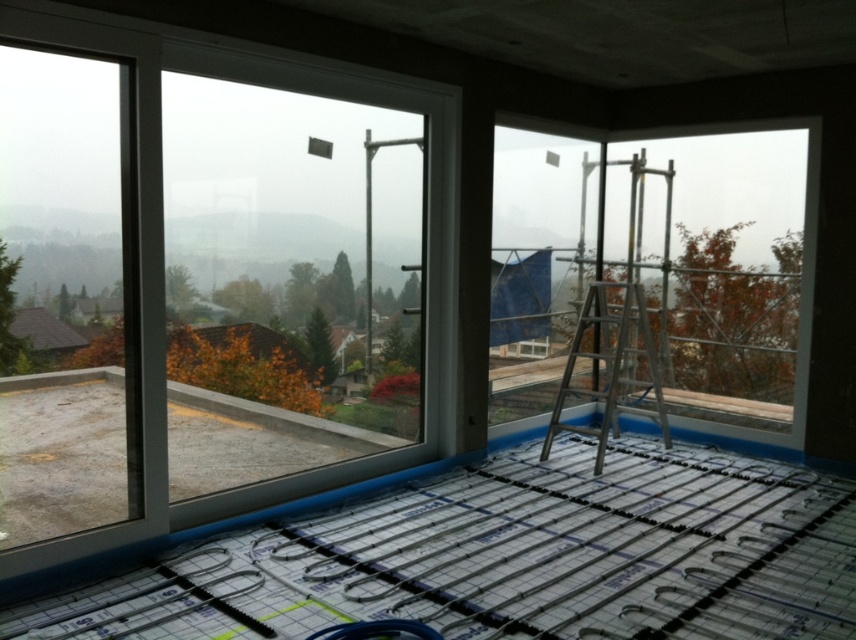
Question: Can you confirm if clear glass window at upper center is bigger than silver metallic ladder at center?

Choices:
 (A) yes
 (B) no

Answer: (A)

Question: Which point is closer to the camera?

Choices:
 (A) clear glass window at upper center
 (B) transparent glass window at upper left
 (C) silver metallic ladder at center

Answer: (B)

Question: Is clear glass window at upper center positioned at the back of silver metallic ladder at center?

Choices:
 (A) yes
 (B) no

Answer: (A)

Question: Is transparent glass window at upper left closer to the viewer compared to clear glass window at upper center?

Choices:
 (A) no
 (B) yes

Answer: (B)

Question: Which of these objects is positioned farthest from the transparent glass window at upper left?

Choices:
 (A) silver metallic ladder at center
 (B) clear glass window at upper center

Answer: (A)

Question: Which point is farther from the camera taking this photo?

Choices:
 (A) (663, 422)
 (B) (290, 419)
 (C) (767, 262)

Answer: (C)